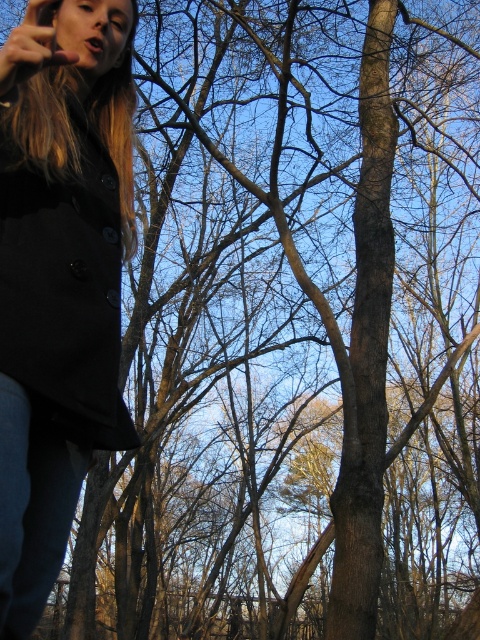
Question: In this image, where is black matte coat at left located relative to jeans at lower left?

Choices:
 (A) above
 (B) below

Answer: (A)

Question: Can you confirm if black matte coat at left is thinner than jeans at lower left?

Choices:
 (A) no
 (B) yes

Answer: (A)

Question: Which point is farther from the camera taking this photo?

Choices:
 (A) (27, 500)
 (B) (76, 100)

Answer: (B)

Question: Which point is farther to the camera?

Choices:
 (A) jeans at lower left
 (B) black matte coat at left

Answer: (A)

Question: Is black matte coat at left to the right of jeans at lower left from the viewer's perspective?

Choices:
 (A) yes
 (B) no

Answer: (A)

Question: Which object is closer to the camera taking this photo?

Choices:
 (A) black matte coat at left
 (B) jeans at lower left

Answer: (A)